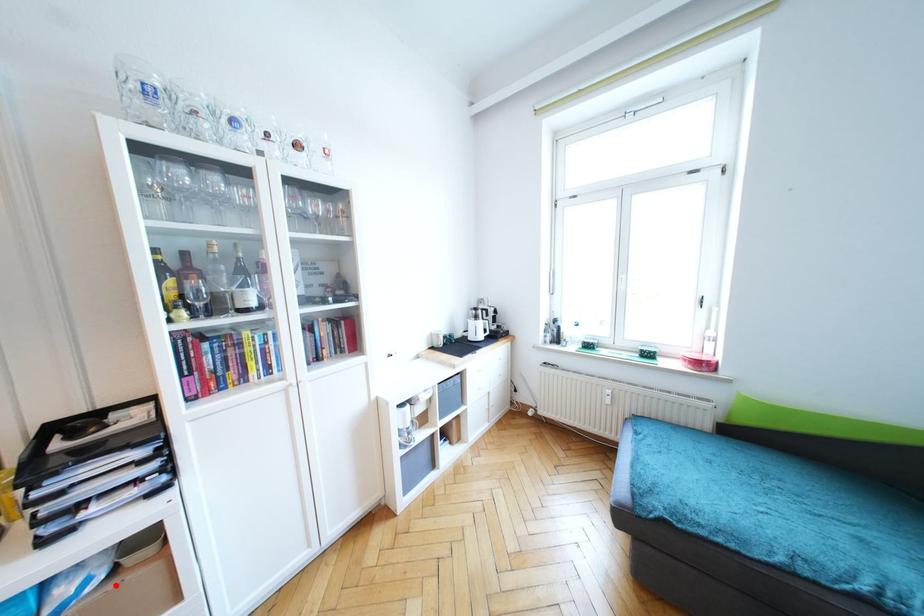
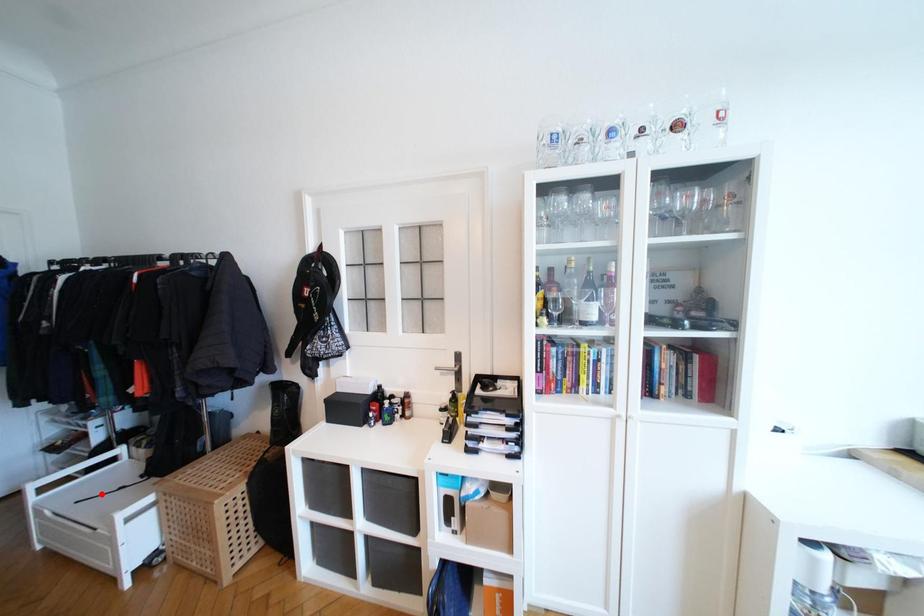
I am providing you with two images of the same scene from different viewpoints. A red point is marked on the first image and another point is marked on the second image. Is the marked point in image1 the same physical position as the marked point in image2?

No